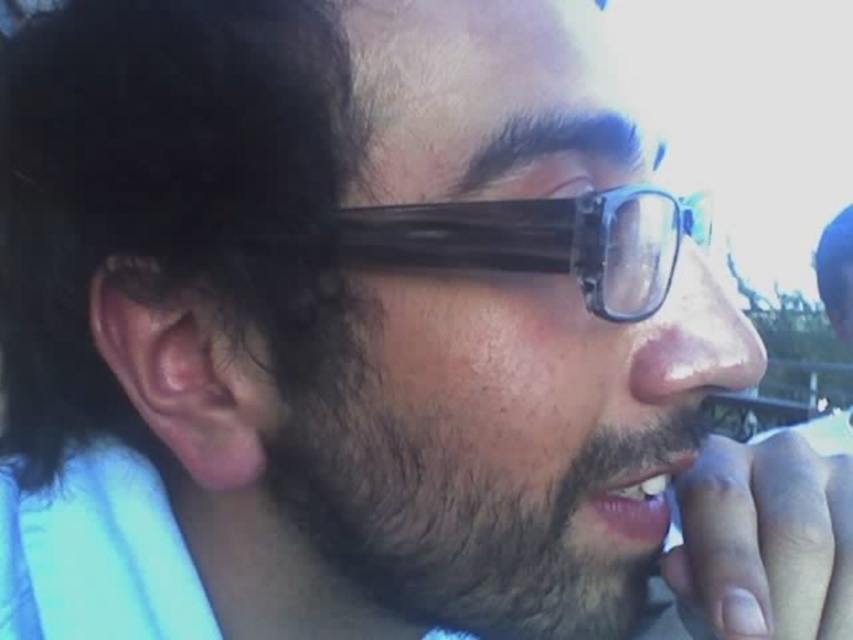
You are a photographer trying to capture a close up of the person in the image. The photographer wants to ensure that both the dark brown fuzzy beard at lower left and the black plastic glasses at center are clearly visible in the frame. Based on their positions, which object should be placed closer to the left edge of the photo to maintain their natural arrangement?

The dark brown fuzzy beard at lower left should be placed closer to the left edge of the photo because it is positioned on the left side of the black plastic glasses at center, maintaining their natural arrangement.